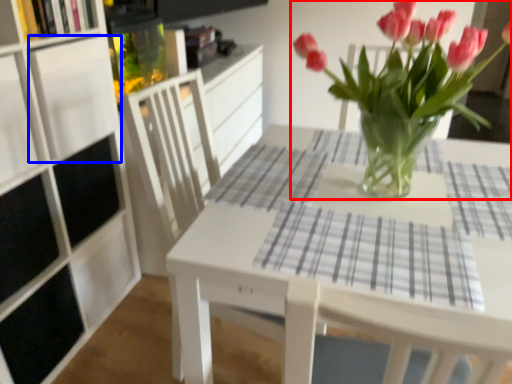
Question: Which object appears farthest to the camera in this image, houseplant (highlighted by a red box) or shelf (highlighted by a blue box)?

Choices:
 (A) houseplant
 (B) shelf

Answer: (B)